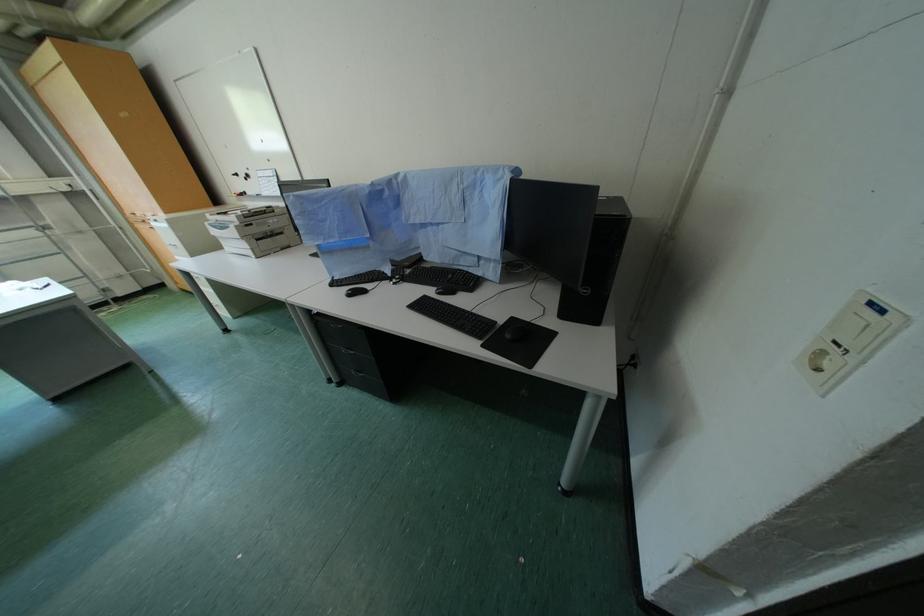
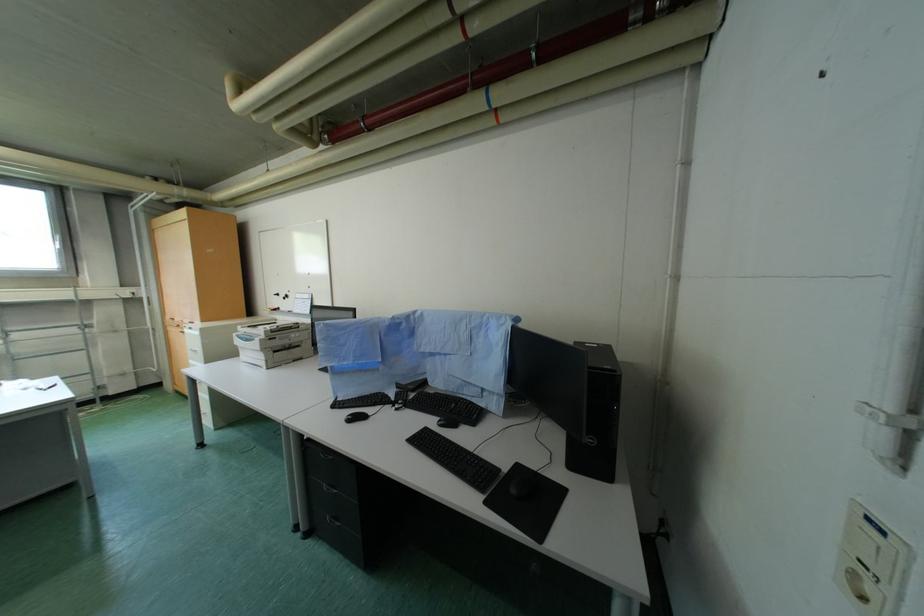
Question: The images are taken continuously from a first-person perspective. In which direction are you moving?

Choices:
 (A) Left
 (B) Right
 (C) Forward
 (D) Backward

Answer: (D)